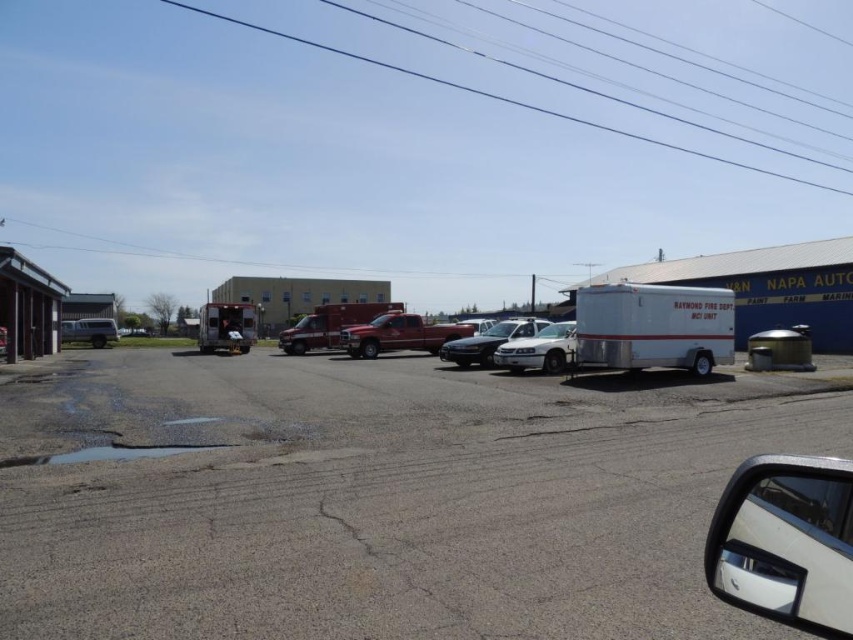
You are standing at the point marked by the coordinates point at (x=538, y=349) in the image. What vehicle are you currently standing on?

You are standing on the white glossy sedan at center, as the point at (x=538, y=349) is located on it.

You are a delivery driver who needs to park your truck between the white glossy sedan at center and the white matte van at left. Based on their positions, is there enough space for your truck which is 6 meters long? Please explain your reasoning.

The white glossy sedan at center is located below the white matte van at left, meaning they are positioned vertically. Since the sedan is below the van, there is likely sufficient vertical space between them to accommodate your 6 meter long truck.